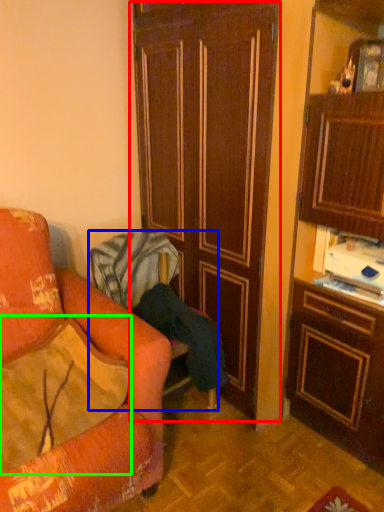
Question: Based on their relative distances, which object is nearer to door (highlighted by a red box)? Choose from chair (highlighted by a blue box) and pillow (highlighted by a green box).

Choices:
 (A) chair
 (B) pillow

Answer: (A)